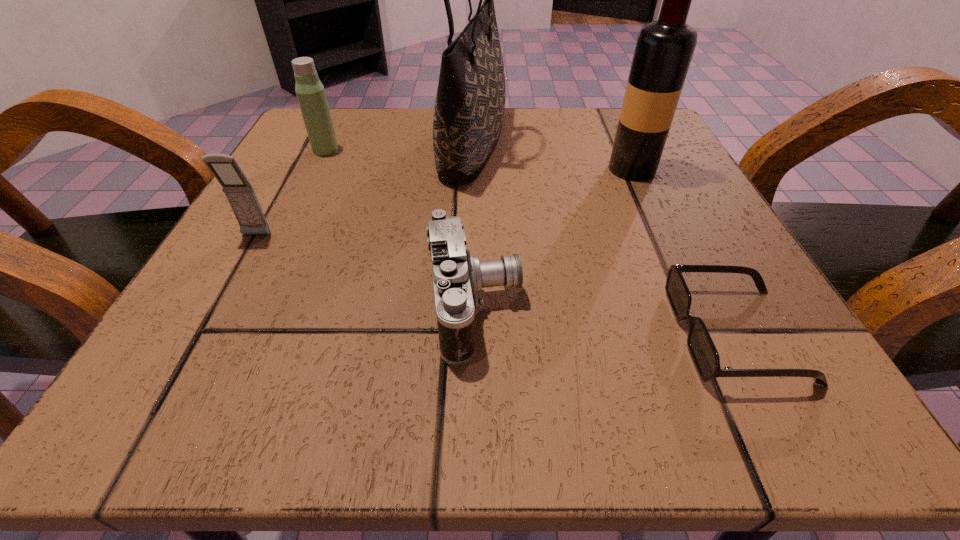
You are a GUI agent. You are given a task and a screenshot of the screen. Output one action in this format:
    pyautogui.click(x=<x>, y=<y>)
    Task: Click on the tote bag
    This screenshot has height=540, width=960.
    Given the screenshot: What is the action you would take?
    pyautogui.click(x=470, y=103)

Locate an element on the screen. This screenshot has width=960, height=540. wine bottle is located at coordinates (664, 48).

Image resolution: width=960 pixels, height=540 pixels. Find the location of `thermos bottle`. thermos bottle is located at coordinates (310, 92).

I want to click on cellular telephone, so click(x=240, y=194).

You are a GUI agent. You are given a task and a screenshot of the screen. Output one action in this format:
    pyautogui.click(x=<x>, y=<y>)
    Task: Click on the fourth farthest object
    The width and height of the screenshot is (960, 540).
    Given the screenshot: What is the action you would take?
    pyautogui.click(x=240, y=194)

What are the coordinates of `camera` in the screenshot? It's located at (457, 276).

I want to click on sunglasses, so click(x=705, y=356).

Locate an element on the screen. The image size is (960, 540). free space located 0.060m on the front of the tote bag is located at coordinates coord(471,212).

The image size is (960, 540). Identify the location of free space located 0.170m on the front of the wine bottle. (668, 248).

This screenshot has width=960, height=540. Identify the location of vacant region located 0.370m on the right of the thermos bottle. (537, 150).